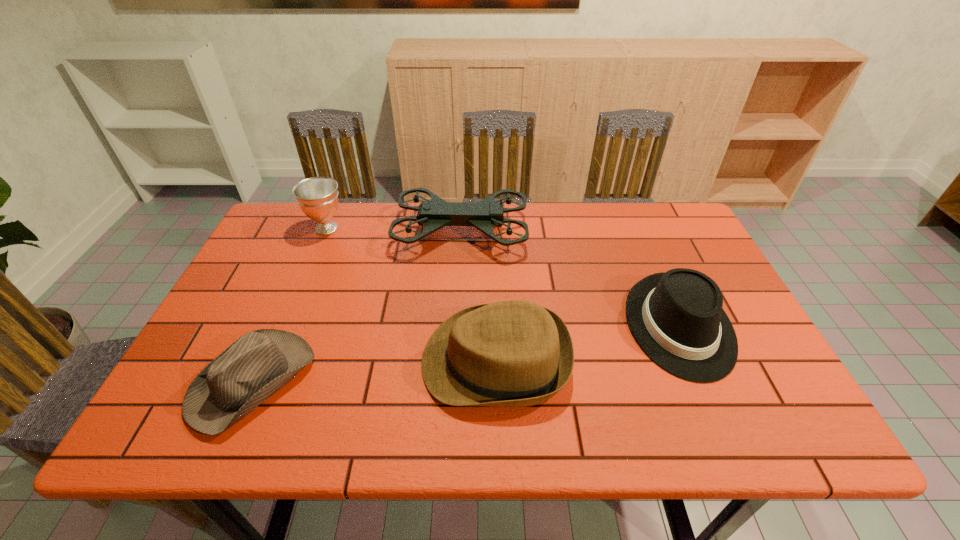
Locate an element on the screen. free space between the second fedora from left to right and the rightmost object is located at coordinates (588, 343).

At what (x,y) coordinates should I click in order to perform the action: click on vacant area that lies between the second fedora from right to left and the shortest fedora. Please return your answer as a coordinate pair (x, y). Image resolution: width=960 pixels, height=540 pixels. Looking at the image, I should click on (374, 371).

I want to click on vacant space in between the second fedora from left to right and the rightmost object, so click(x=588, y=343).

You are a GUI agent. You are given a task and a screenshot of the screen. Output one action in this format:
    pyautogui.click(x=<x>, y=<y>)
    Task: Click on the vacant area between the rightmost fedora and the second fedora from left to right
    
    Given the screenshot: What is the action you would take?
    pyautogui.click(x=588, y=343)

The height and width of the screenshot is (540, 960). Identify the location of object that is the closest to the rightmost fedora. (515, 353).

Locate which object is the fourth closest to the shortest object. Please provide its 2D coordinates. Your answer should be formatted as a tuple, i.e. [(x, y)], where the tuple contains the x and y coordinates of a point satisfying the conditions above.

[(676, 317)]

At what (x,y) coordinates should I click in order to perform the action: click on fedora that stands as the closest to the rightmost object. Please return your answer as a coordinate pair (x, y). The height and width of the screenshot is (540, 960). Looking at the image, I should click on (515, 353).

Point out which fedora is positioned as the nearest to the second fedora from left to right. Please provide its 2D coordinates. Your answer should be formatted as a tuple, i.e. [(x, y)], where the tuple contains the x and y coordinates of a point satisfying the conditions above.

[(676, 317)]

Where is `free point that satisfies the following two spatial constraints: 1. on the front-facing side of the rightmost fedora; 2. on the front-facing side of the second fedora from left to right`? free point that satisfies the following two spatial constraints: 1. on the front-facing side of the rightmost fedora; 2. on the front-facing side of the second fedora from left to right is located at coordinates (694, 361).

Locate an element on the screen. The width and height of the screenshot is (960, 540). vacant region that satisfies the following two spatial constraints: 1. on the front-facing side of the rightmost object; 2. on the front-facing side of the second fedora from left to right is located at coordinates (694, 361).